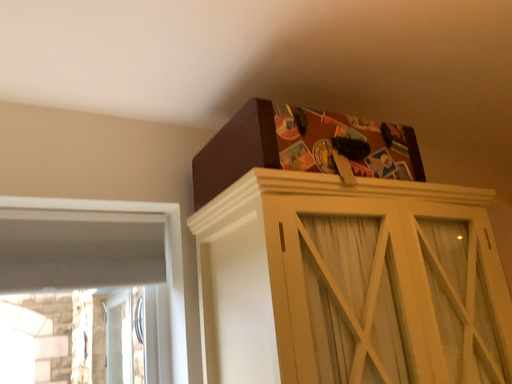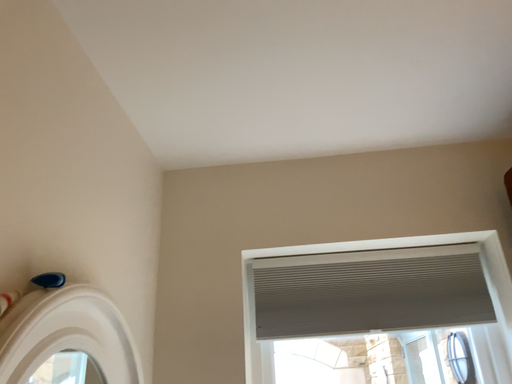
Question: Which way did the camera rotate in the video?

Choices:
 (A) rotated left
 (B) rotated right

Answer: (A)